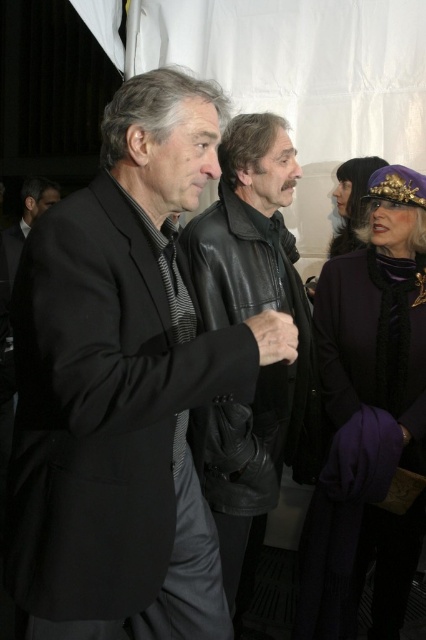
Is black matte suit at center smaller than black leather jacket at center?

Yes.

Can you confirm if black matte suit at center is thinner than black leather jacket at center?

In fact, black matte suit at center might be wider than black leather jacket at center.

Locate an element on the screen. The image size is (426, 640). black matte suit at center is located at coordinates (109, 420).

Can you confirm if black leather jacket at center is wider than shiny purple hat at upper right?

Indeed, black leather jacket at center has a greater width compared to shiny purple hat at upper right.

Between black leather jacket at center and shiny purple hat at upper right, which one has more height?

With more height is black leather jacket at center.

Is point (210, 458) positioned in front of point (351, 172)?

Yes, point (210, 458) is closer to viewer.

Find the location of a particular element. black leather jacket at center is located at coordinates (244, 320).

This screenshot has height=640, width=426. Describe the element at coordinates (109, 420) in the screenshot. I see `black matte suit at center` at that location.

Measure the distance between point [103,321] and camera.

They are 3.90 feet apart.

Is point (164, 449) positioned after point (348, 168)?

No, (164, 449) is closer to viewer.

Where is `black matte suit at center`? The width and height of the screenshot is (426, 640). black matte suit at center is located at coordinates (109, 420).